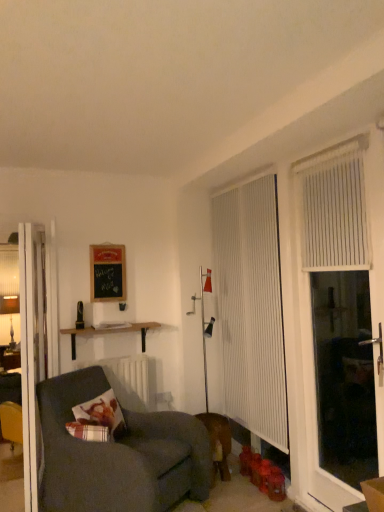
Question: Is dark gray fabric couch at lower left bigger or smaller than white glossy door at left?

Choices:
 (A) small
 (B) big

Answer: (B)

Question: Is dark gray fabric couch at lower left spatially inside white glossy door at left, or outside of it?

Choices:
 (A) inside
 (B) outside

Answer: (B)

Question: Which is farther from the plaid fabric pillow at lower left?

Choices:
 (A) white vertical blinds at right
 (B) wooden shelf at upper left
 (C) white vertical blinds at right, the 1th curtain viewed from the front
 (D) white vertical blinds at right, which is the second curtain in front-to-back order
 (E) brown leather dog at lower center

Answer: (C)

Question: Estimate the real-world distances between objects in this image. Which object is farther from the wooden shelf at upper left?

Choices:
 (A) white glossy door at left
 (B) brown leather dog at lower center
 (C) white vertical blinds at right, which is the 1th curtain in left-to-right order
 (D) black chalkboard at upper left
 (E) white vertical blinds at right, the 2th curtain viewed from the left

Answer: (E)